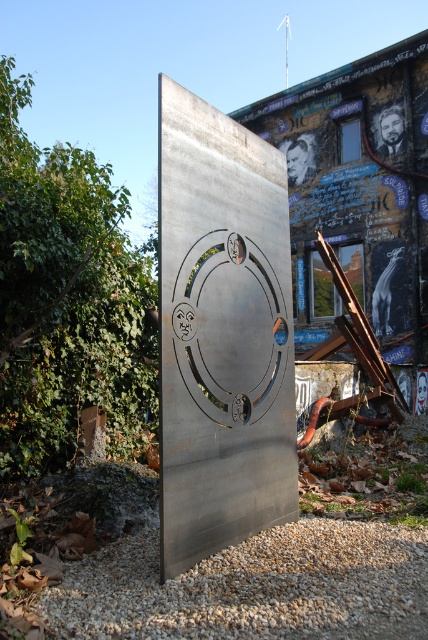
Question: Does metallic silver circle at center have a larger size compared to gray gravel at lower center?

Choices:
 (A) yes
 (B) no

Answer: (A)

Question: Which point is closer to the camera?

Choices:
 (A) metallic silver circle at center
 (B) gray gravel at lower center

Answer: (B)

Question: Which point is farther to the camera?

Choices:
 (A) (243, 180)
 (B) (407, 573)

Answer: (A)

Question: Considering the relative positions of metallic silver circle at center and gray gravel at lower center in the image provided, where is metallic silver circle at center located with respect to gray gravel at lower center?

Choices:
 (A) right
 (B) left

Answer: (B)

Question: Can you confirm if metallic silver circle at center is bigger than gray gravel at lower center?

Choices:
 (A) no
 (B) yes

Answer: (B)

Question: Which point appears closest to the camera in this image?

Choices:
 (A) (205, 333)
 (B) (315, 596)

Answer: (B)